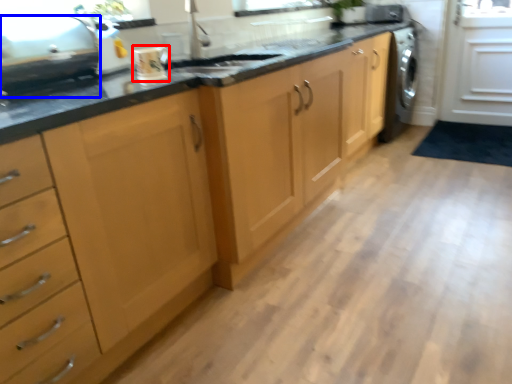
Question: Among these objects, which one is nearest to the camera, kitchen appliance (highlighted by a red box) or appliance (highlighted by a blue box)?

Choices:
 (A) kitchen appliance
 (B) appliance

Answer: (B)